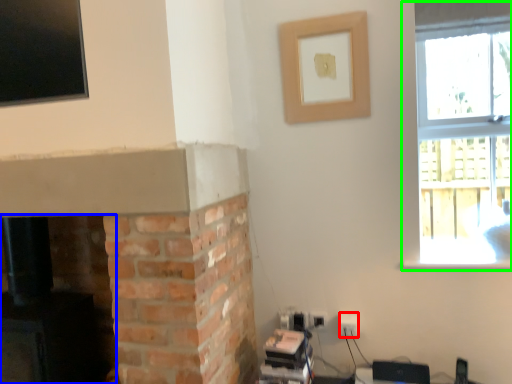
Question: Which is farther away from electric outlet (highlighted by a red box)? fireplace (highlighted by a blue box) or window (highlighted by a green box)?

Choices:
 (A) fireplace
 (B) window

Answer: (B)